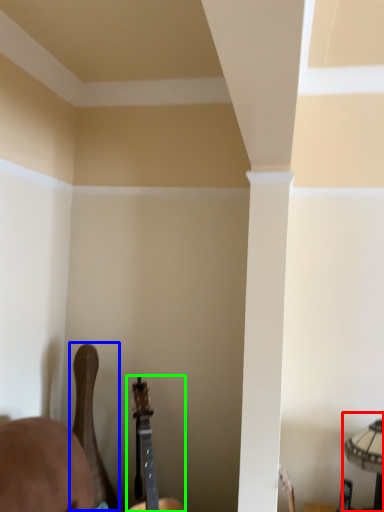
Question: Which object is positioned farthest from lamp (highlighted by a red box)? Select from guitar (highlighted by a blue box) and guitar (highlighted by a green box).

Choices:
 (A) guitar
 (B) guitar

Answer: (A)